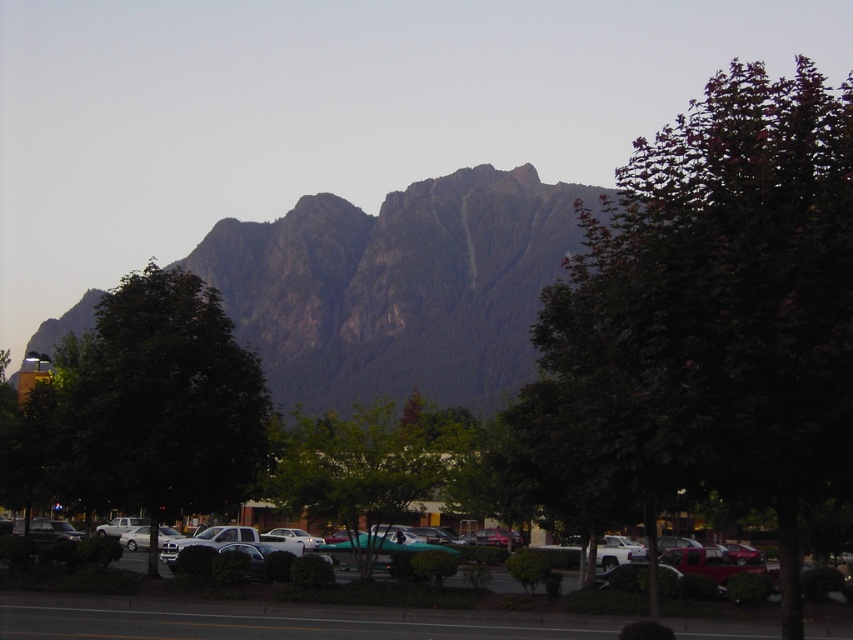
You are standing in the parking lot and want to walk towards the green leafy tree at upper right and the green leafy tree at left. Which tree will you reach first?

The green leafy tree at upper right is closer to the viewer than the green leafy tree at left, so you will reach the green leafy tree at upper right first.

You are standing in the parking lot and want to take a photo of the green leafy tree at center without the metallic gray cars at center blocking the view. Is there a way to do this?

The metallic gray cars at center are closer to the viewer than the green leafy tree at center, so moving closer to the tree or finding a position where the cars are out of the frame would allow you to take a photo without obstruction.